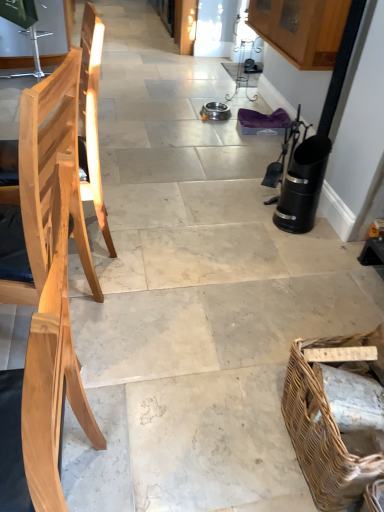
Locate an element on the screen. The width and height of the screenshot is (384, 512). vacant area that is situated to the right of natural wood chair at left, the 2th chair in the top-to-bottom sequence is located at coordinates (162, 471).